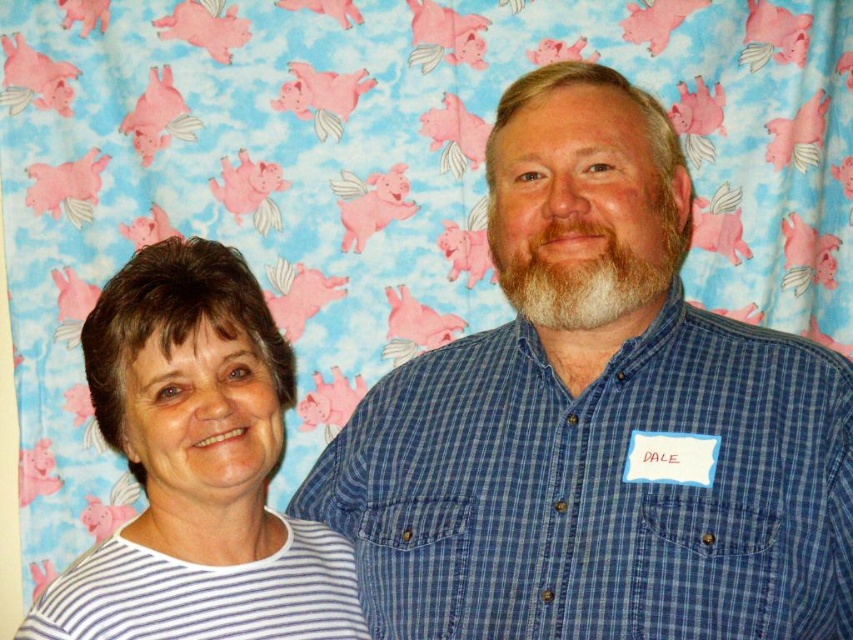
From the picture: Between blue checkered shirt at center and white striped shirt at left, which one has more height?

Standing taller between the two is blue checkered shirt at center.

Is blue checkered shirt at center to the left of white striped shirt at left from the viewer's perspective?

No, blue checkered shirt at center is not to the left of white striped shirt at left.

What do you see at coordinates (596, 419) in the screenshot?
I see `blue checkered shirt at center` at bounding box center [596, 419].

What are the coordinates of `blue checkered shirt at center` in the screenshot? It's located at (596, 419).